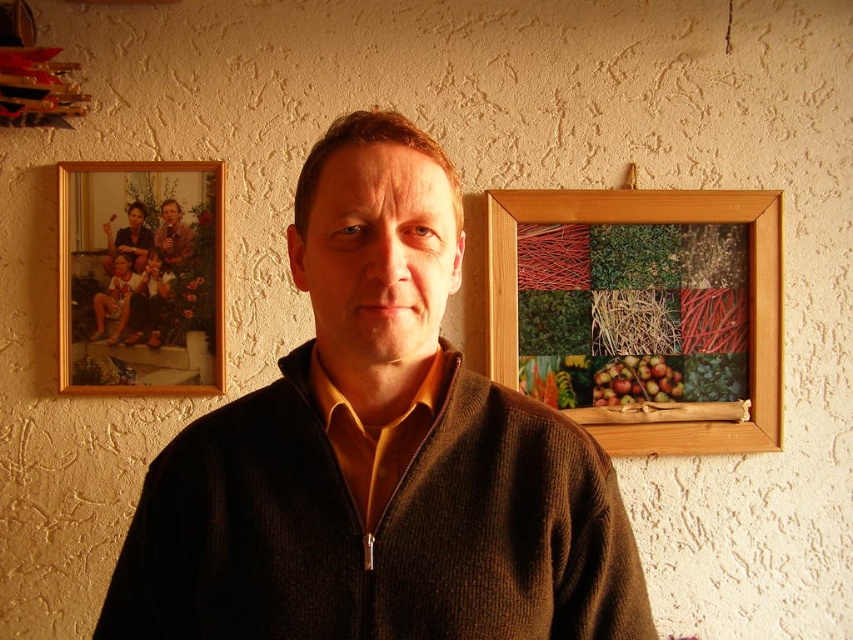
Between point (561, 314) and point (669, 371), which one is positioned behind?

The point (669, 371) is more distant.

I want to click on wooden picture frame at upper right, so click(641, 314).

Is wooden picture frame at upper right above gold wooden picture frame at upper left?

No.

Can you confirm if wooden picture frame at upper right is positioned to the left of gold wooden picture frame at upper left?

In fact, wooden picture frame at upper right is to the right of gold wooden picture frame at upper left.

Is point (544, 372) more distant than point (144, 170)?

Yes, point (544, 372) is behind point (144, 170).

I want to click on wooden picture frame at upper right, so click(x=641, y=314).

Can you confirm if brown knitted sweater at center is bigger than gold wooden picture frame at upper left?

Yes.

Identify the location of brown knitted sweater at center. (378, 454).

Which is behind, point (415, 618) or point (223, 269)?

The point (223, 269) is more distant.

This screenshot has width=853, height=640. Find the location of `brown knitted sweater at center`. brown knitted sweater at center is located at coordinates (378, 454).